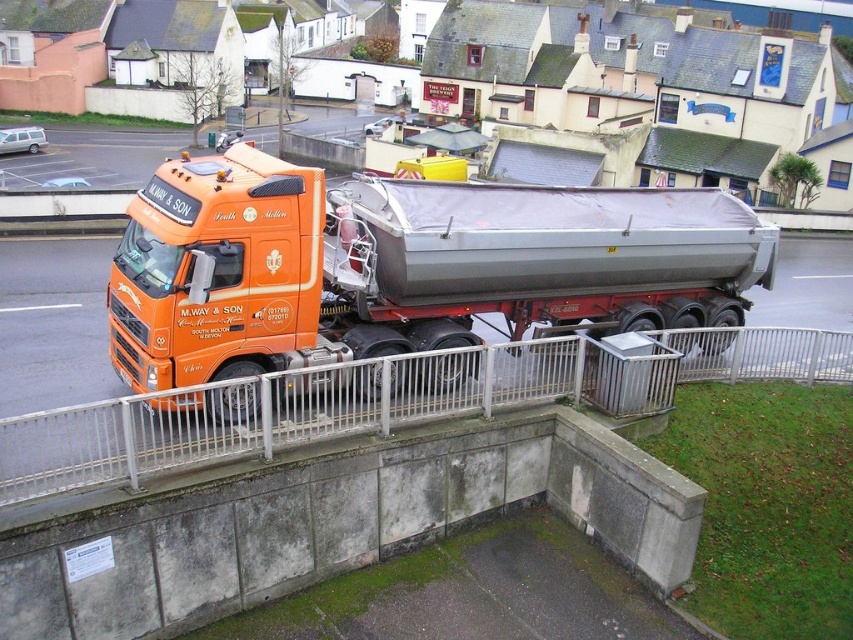
Is orange matte truck at center to the right of white metal rail at center from the viewer's perspective?

No, orange matte truck at center is not to the right of white metal rail at center.

Describe the element at coordinates (404, 266) in the screenshot. I see `orange matte truck at center` at that location.

I want to click on orange matte truck at center, so click(x=404, y=266).